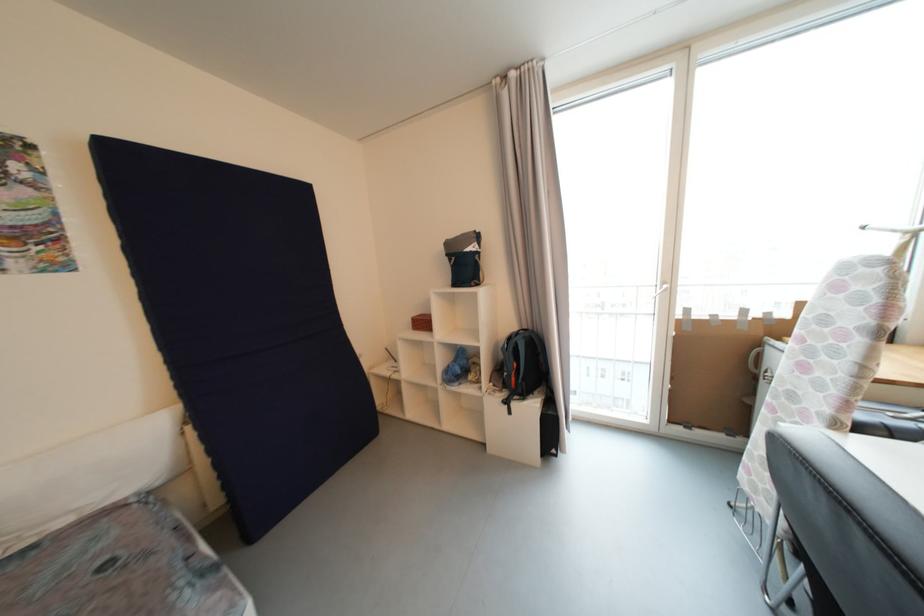
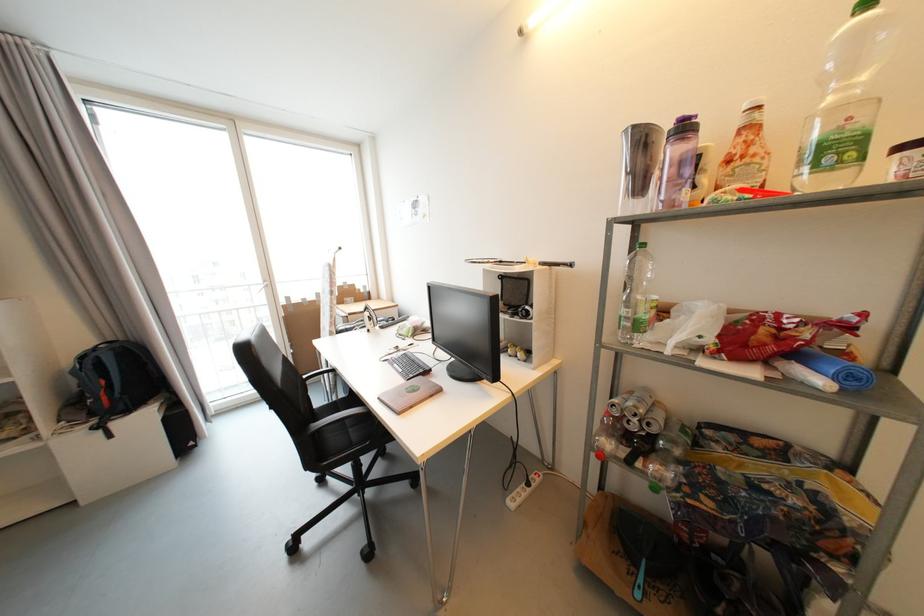
Find the pixel in the second image that matches point 512,405 in the first image.

(104, 429)